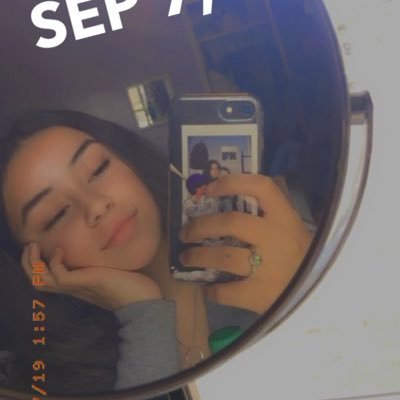
Find the location of a particular element. phone is located at coordinates (193, 109).